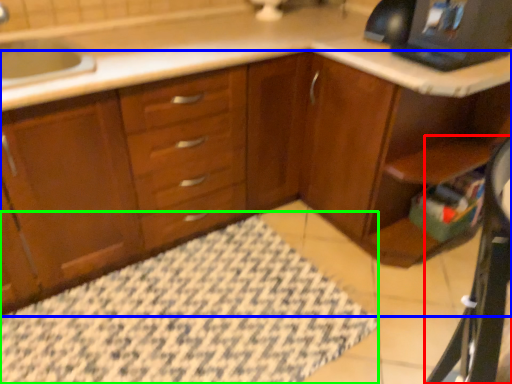
Question: Estimate the real-world distances between objects in this image. Which object is farther from computer desk (highlighted by a red box), cabinetry (highlighted by a blue box) or bath mat (highlighted by a green box)?

Choices:
 (A) cabinetry
 (B) bath mat

Answer: (A)